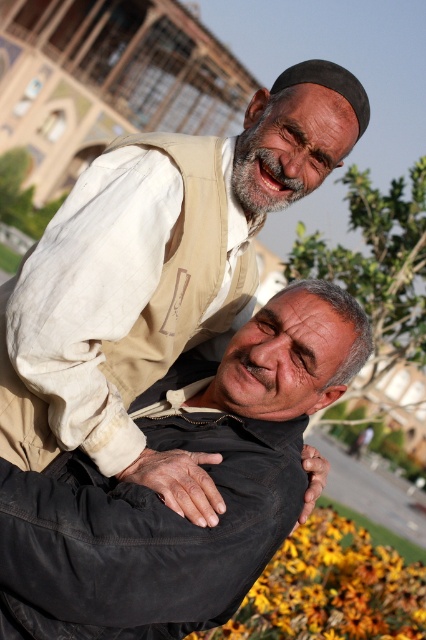
You are standing in the park and see the beige fabric sleeve at upper left and the yellow matte flower at lower center. Which object is nearer to you?

The beige fabric sleeve at upper left is closer to the viewer than the yellow matte flower at lower center.

You are an artist sketching the scene and want to draw the beige fabric sleeve at upper left and the yellow matte flower at lower center. Which object should you sketch first if you want to follow the left to right order?

The beige fabric sleeve at upper left should be sketched first because it is positioned on the left side of the yellow matte flower at lower center.

You are a photographer trying to capture a closeup of the yellow matte flower at lower center without the beige fabric sleeve at upper left blocking the view. What adjustment should you make to your camera angle?

The beige fabric sleeve at upper left is located above the yellow matte flower at lower center, so you should lower your camera angle to avoid the sleeve blocking the flower.